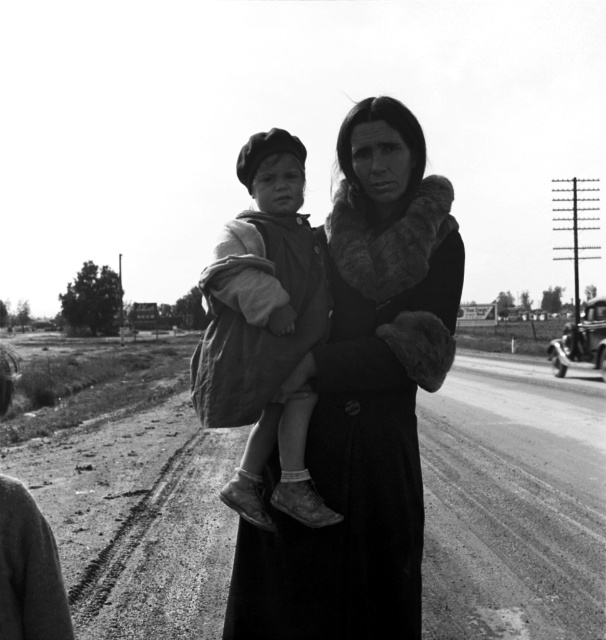
Question: Which object is farther from the camera taking this photo?

Choices:
 (A) dirt track at center
 (B) ragged fabric child at center

Answer: (A)

Question: Is dark fur coat at center closer to the viewer compared to ragged fabric child at center?

Choices:
 (A) no
 (B) yes

Answer: (B)

Question: Can you confirm if dirt track at center is wider than dark fur coat at center?

Choices:
 (A) no
 (B) yes

Answer: (B)

Question: Which point is closer to the camera?

Choices:
 (A) (524, 529)
 (B) (271, 420)
 (C) (364, 109)

Answer: (B)

Question: Can you confirm if dark fur coat at center is thinner than ragged fabric child at center?

Choices:
 (A) no
 (B) yes

Answer: (A)

Question: Which point is closer to the camera?

Choices:
 (A) (499, 592)
 (B) (370, 140)
 (C) (211, 276)

Answer: (C)